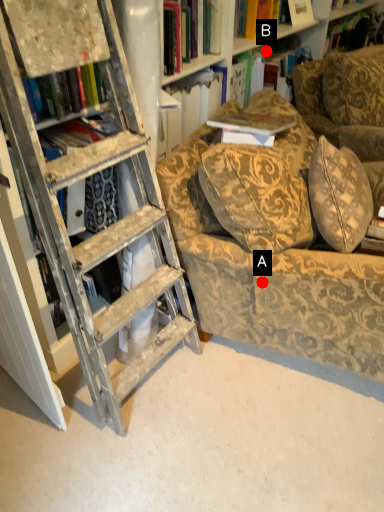
Question: Two points are circled on the image, labeled by A and B beside each circle. Which point is farther to the camera?

Choices:
 (A) A is further
 (B) B is further

Answer: (B)